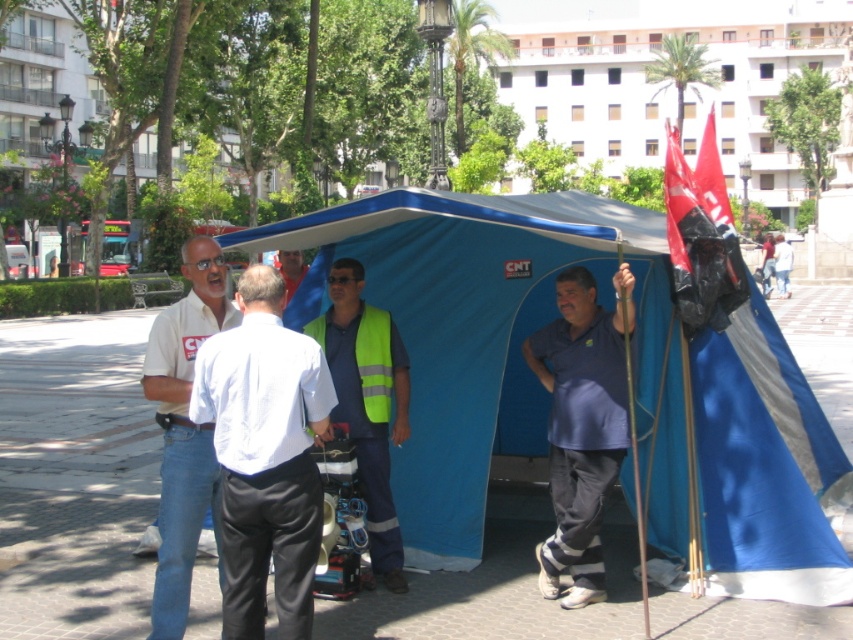
Does white smooth shirt at left appear over light blue shirt at center?

Incorrect, white smooth shirt at left is not positioned above light blue shirt at center.

Who is lower down, white smooth shirt at left or light blue shirt at center?

white smooth shirt at left is lower down.

Where is `white smooth shirt at left`? The width and height of the screenshot is (853, 640). white smooth shirt at left is located at coordinates (265, 456).

Does reflective yellow vest at center come behind yellow reflective safety vest at center?

No, reflective yellow vest at center is in front of yellow reflective safety vest at center.

Does reflective yellow vest at center have a lesser width compared to yellow reflective safety vest at center?

No, reflective yellow vest at center is not thinner than yellow reflective safety vest at center.

Who is more distant from viewer, [335,413] or [363,365]?

Point [363,365]

Locate an element on the screen. This screenshot has height=640, width=853. reflective yellow vest at center is located at coordinates (367, 403).

Is blue fabric tent at center bigger than white smooth shirt at left?

Correct, blue fabric tent at center is larger in size than white smooth shirt at left.

This screenshot has height=640, width=853. I want to click on blue fabric tent at center, so [x=494, y=342].